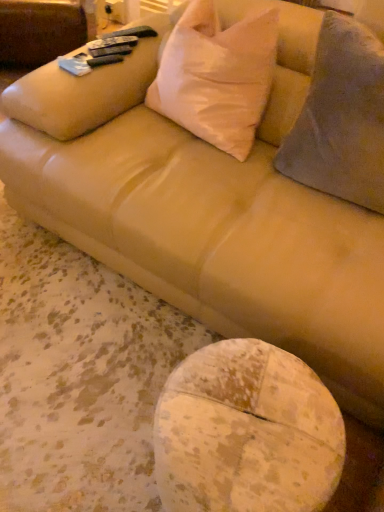
Question: From the image's perspective, is speckled wood table at lower center above or below gray fuzzy throw pillow at right, acting as the second throw pillow starting from the left?

Choices:
 (A) below
 (B) above

Answer: (A)

Question: Would you say speckled wood table at lower center is inside or outside gray fuzzy throw pillow at right, acting as the second throw pillow starting from the left?

Choices:
 (A) inside
 (B) outside

Answer: (B)

Question: Which object is the farthest from the speckled wood table at lower center?

Choices:
 (A) white matte pillow at upper center, the 2th throw pillow in the right-to-left sequence
 (B) gray fuzzy throw pillow at right, positioned as the first throw pillow in right-to-left order

Answer: (A)

Question: Estimate the real-world distances between objects in this image. Which object is farther from the speckled wood table at lower center?

Choices:
 (A) gray fuzzy throw pillow at right, positioned as the first throw pillow in right-to-left order
 (B) white matte pillow at upper center, the first throw pillow from the left

Answer: (B)